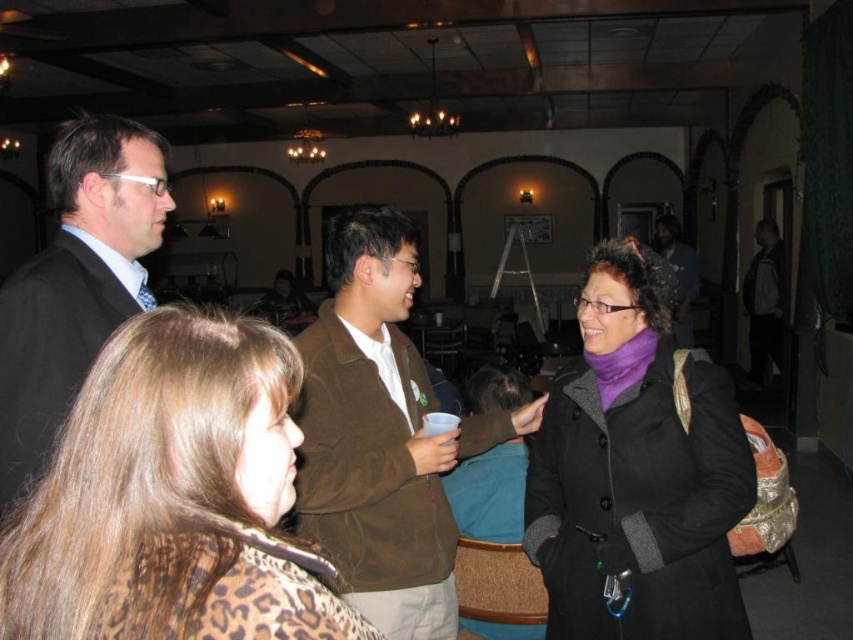
Question: Which of the following is the farthest from the observer?

Choices:
 (A) brown suede jacket at center
 (B) leopard print scarf at lower left

Answer: (A)

Question: From the image, what is the correct spatial relationship of matte black coat at center in relation to dark brown leather jacket at center?

Choices:
 (A) above
 (B) below

Answer: (B)

Question: Is matte black suit at left below dark brown leather jacket at center?

Choices:
 (A) yes
 (B) no

Answer: (A)

Question: Which is nearer to the dark brown leather jacket at center?

Choices:
 (A) leopard print scarf at lower left
 (B) brown suede jacket at center

Answer: (B)

Question: Which object is positioned farthest from the brown suede jacket at center?

Choices:
 (A) matte black coat at center
 (B) matte black suit at left
 (C) leopard print scarf at lower left
 (D) dark gray jacket at right

Answer: (D)

Question: Can you confirm if matte black coat at center is thinner than dark gray jacket at right?

Choices:
 (A) yes
 (B) no

Answer: (B)